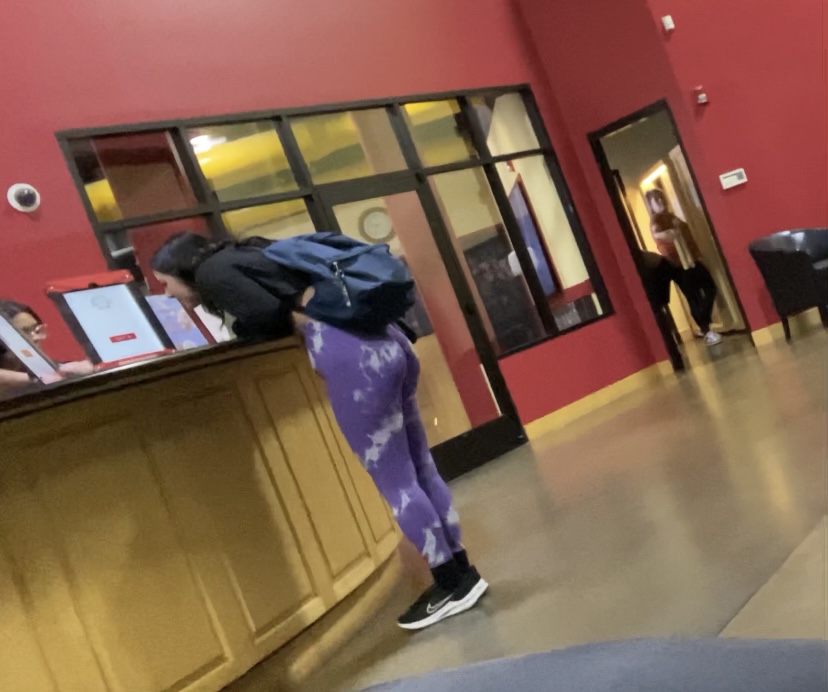
The image size is (828, 692). Find the location of `white box on wall`. white box on wall is located at coordinates (733, 185).